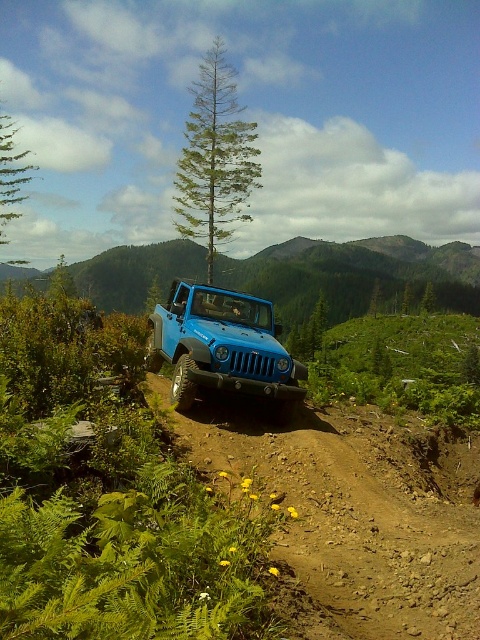
Does point (356, 371) come closer to viewer compared to point (199, 211)?

No, it is not.

Between point (374, 349) and point (201, 154), which one is positioned in front?

Point (201, 154)

Where is `green leafy shrubs at center`? The image size is (480, 640). green leafy shrubs at center is located at coordinates (403, 365).

Is point (292, 472) farther from viewer compared to point (238, 220)?

No.

Does brown rocky dirt track at center appear under green needle-like tree at center?

Indeed, brown rocky dirt track at center is positioned under green needle-like tree at center.

Describe the element at coordinates (352, 520) in the screenshot. The width and height of the screenshot is (480, 640). I see `brown rocky dirt track at center` at that location.

Identify the location of brown rocky dirt track at center. (352, 520).

Is point (180, 324) closer to viewer compared to point (204, 157)?

That is True.

Who is taller, matte blue jeep at center or green needle-like tree at center?

green needle-like tree at center is taller.

The image size is (480, 640). What do you see at coordinates (222, 346) in the screenshot? I see `matte blue jeep at center` at bounding box center [222, 346].

Image resolution: width=480 pixels, height=640 pixels. In order to click on matte blue jeep at center in this screenshot , I will do `click(222, 346)`.